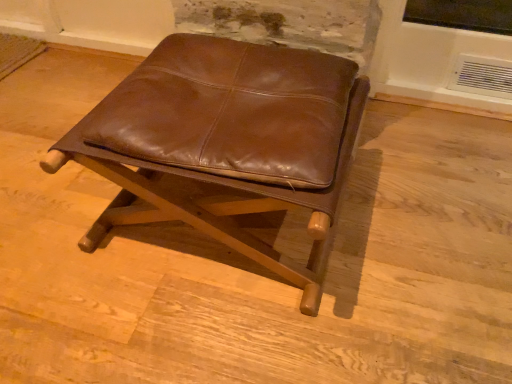
The image size is (512, 384). Identify the location of vacant space in front of brown leather stool at center. (214, 335).